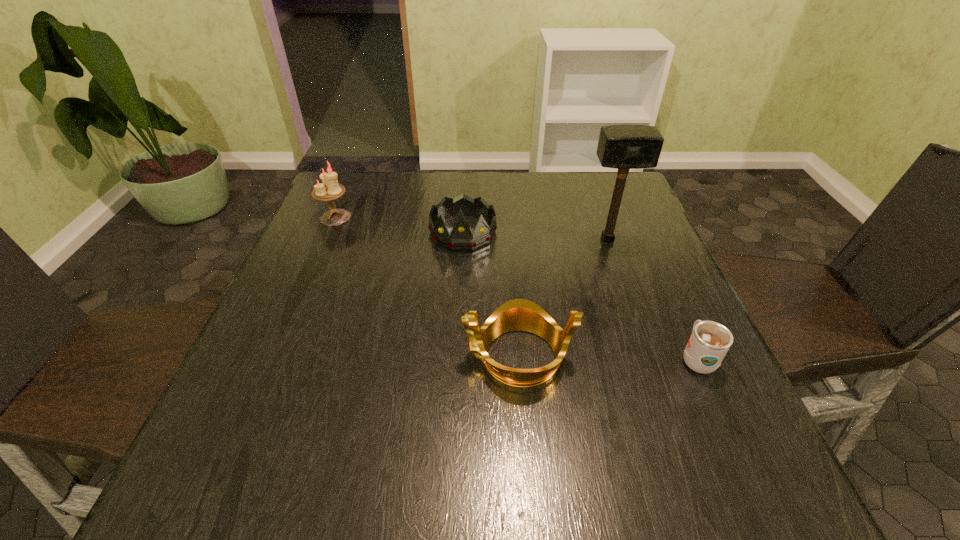
Locate an element on the screen. object that is at the far left corner is located at coordinates (330, 189).

Where is `free location at the far edge of the desktop`? This screenshot has height=540, width=960. free location at the far edge of the desktop is located at coordinates (535, 191).

Image resolution: width=960 pixels, height=540 pixels. Identify the location of free space at the near edge of the desktop. (504, 475).

The height and width of the screenshot is (540, 960). I want to click on vacant space at the left edge of the desktop, so click(288, 347).

Identify the location of vacant space at the right edge. Image resolution: width=960 pixels, height=540 pixels. (631, 250).

The height and width of the screenshot is (540, 960). In the image, there is a desktop. What are the coordinates of `vacant space at the far right corner` in the screenshot? It's located at (632, 217).

The width and height of the screenshot is (960, 540). Find the location of `vacant space at the near right corner of the desktop`. vacant space at the near right corner of the desktop is located at coordinates (741, 450).

I want to click on free spot between the farther tiara and the nearer tiara, so click(x=491, y=294).

This screenshot has width=960, height=540. Find the location of `free space between the leftmost object and the farther tiara`. free space between the leftmost object and the farther tiara is located at coordinates coord(399,225).

Find the location of `empty space between the farther tiara and the tallest object`. empty space between the farther tiara and the tallest object is located at coordinates (535, 235).